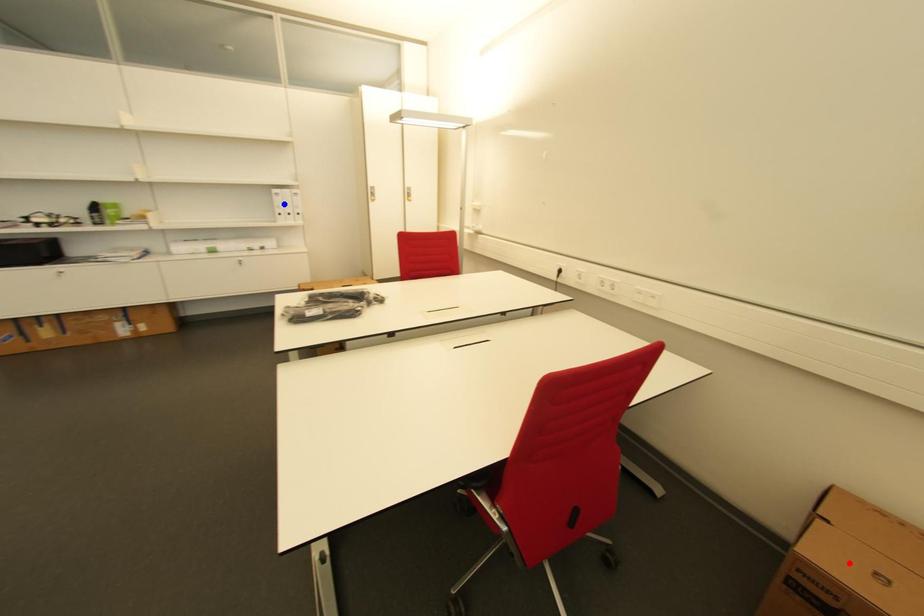
Question: In the image, two points are highlighted. Which point is nearer to the camera? Reply with the corresponding letter.

Choices:
 (A) blue point
 (B) red point

Answer: (B)